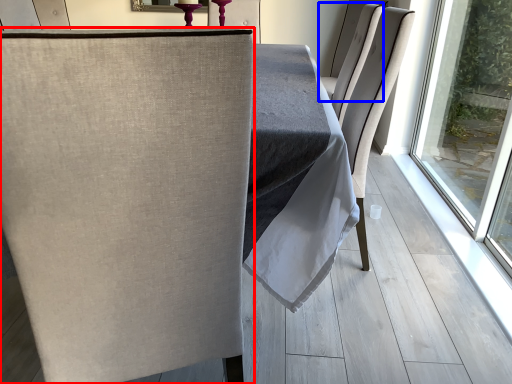
Question: Which object appears farthest to the camera in this image, chair (highlighted by a red box) or chair (highlighted by a blue box)?

Choices:
 (A) chair
 (B) chair

Answer: (B)